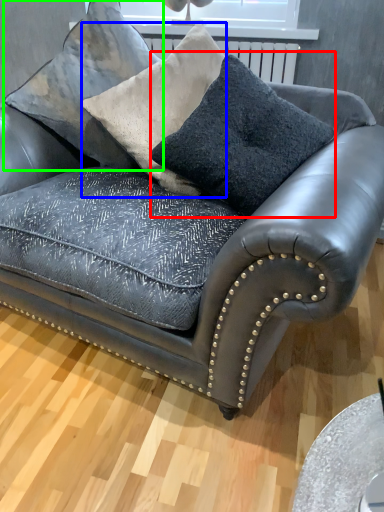
Question: Estimate the real-world distances between objects in this image. Which object is farther from throw pillow (highlighted by a red box), throw pillow (highlighted by a blue box) or pillow (highlighted by a green box)?

Choices:
 (A) throw pillow
 (B) pillow

Answer: (B)